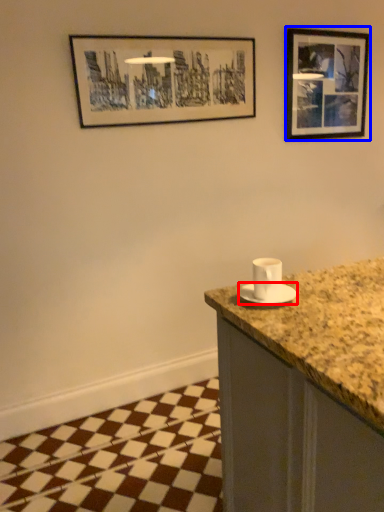
Question: Which of the following is the closest to the observer, saucer (highlighted by a red box) or picture frame (highlighted by a blue box)?

Choices:
 (A) saucer
 (B) picture frame

Answer: (A)